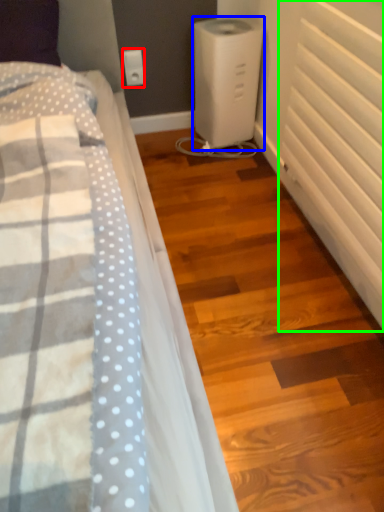
Question: Estimate the real-world distances between objects in this image. Which object is closer to electric outlet (highlighted by a red box), home appliance (highlighted by a blue box) or radiator (highlighted by a green box)?

Choices:
 (A) home appliance
 (B) radiator

Answer: (A)